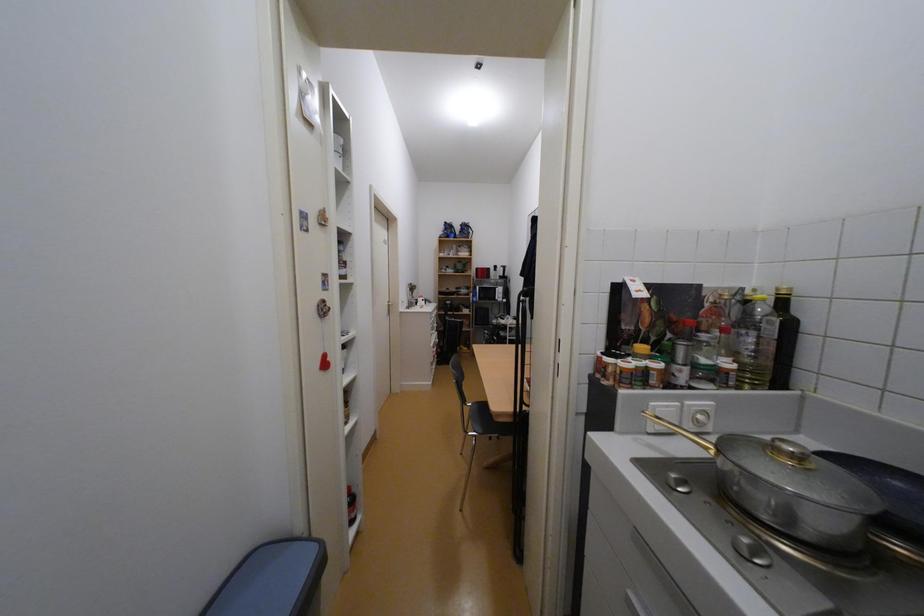
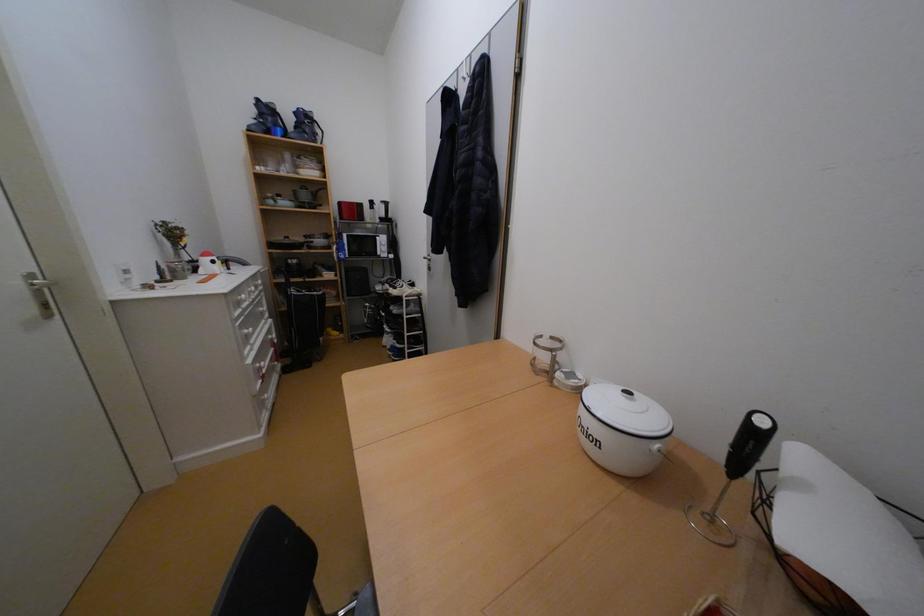
Question: The images are taken continuously from a first-person perspective. In which direction are you moving?

Choices:
 (A) Left
 (B) Right
 (C) Forward
 (D) Backward

Answer: (C)